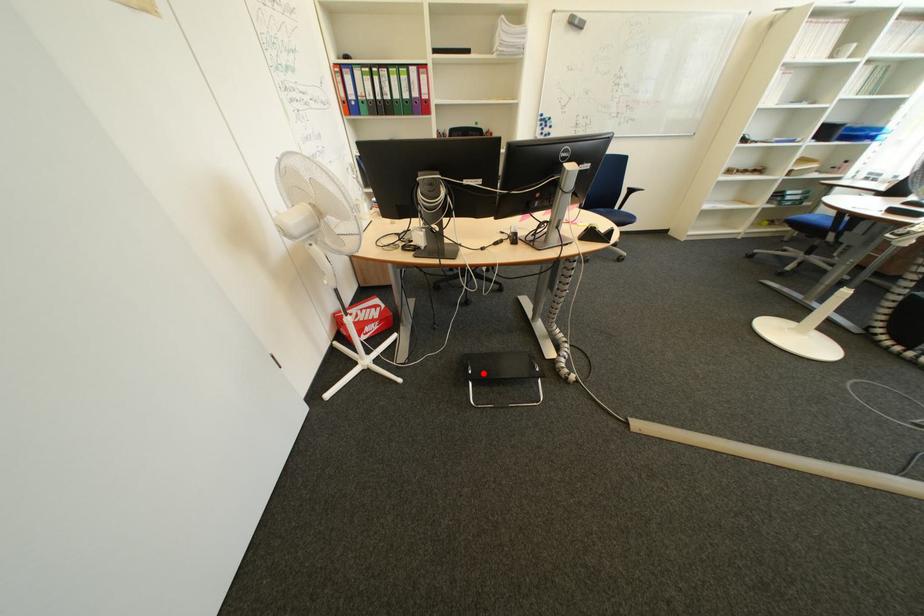
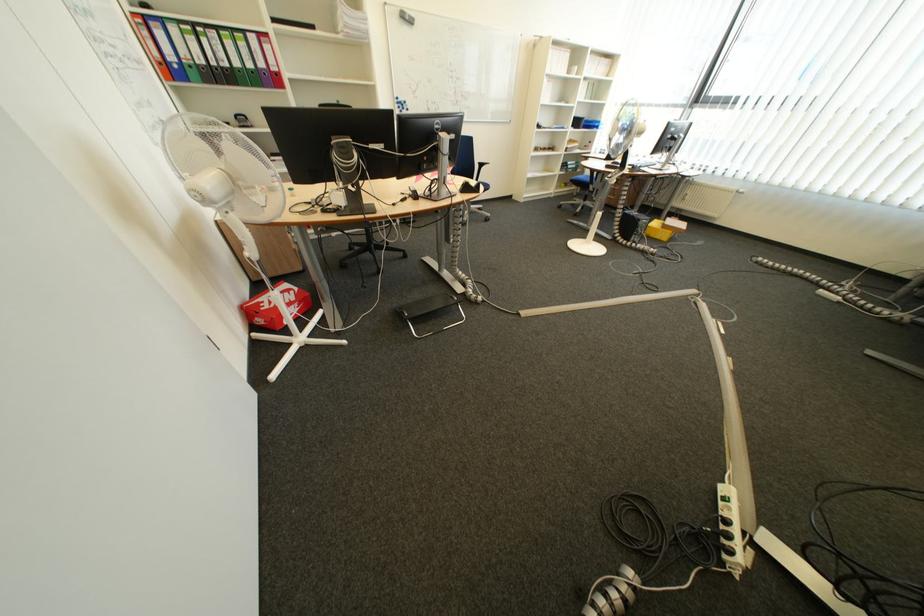
Question: I am providing you with two images of the same scene from different viewpoints. A red point is shown in image1. For the corresponding object point in image2, is it positioned nearer or farther from the camera?

Choices:
 (A) Nearer
 (B) Farther

Answer: (A)